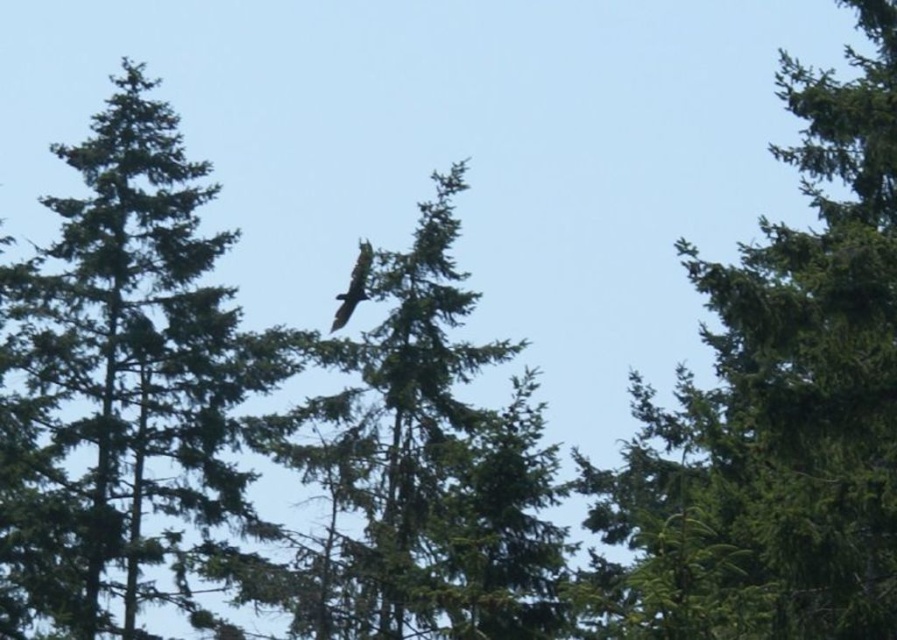
Question: Which of the following is the farthest from the observer?

Choices:
 (A) green textured tree at center
 (B) dark brown feathers at center

Answer: (A)

Question: Which point is farther to the camera?

Choices:
 (A) dark brown feathers at center
 (B) green textured tree at upper center

Answer: (A)

Question: Observing the image, what is the correct spatial positioning of green textured tree at upper center in reference to green textured tree at center?

Choices:
 (A) above
 (B) below

Answer: (B)

Question: Which of the following is the closest to the observer?

Choices:
 (A) green textured tree at upper center
 (B) green textured tree at center

Answer: (A)

Question: In this image, where is green textured tree at center located relative to dark brown feathers at center?

Choices:
 (A) left
 (B) right

Answer: (A)

Question: Where is green textured tree at upper center located in relation to green textured tree at center in the image?

Choices:
 (A) left
 (B) right

Answer: (B)